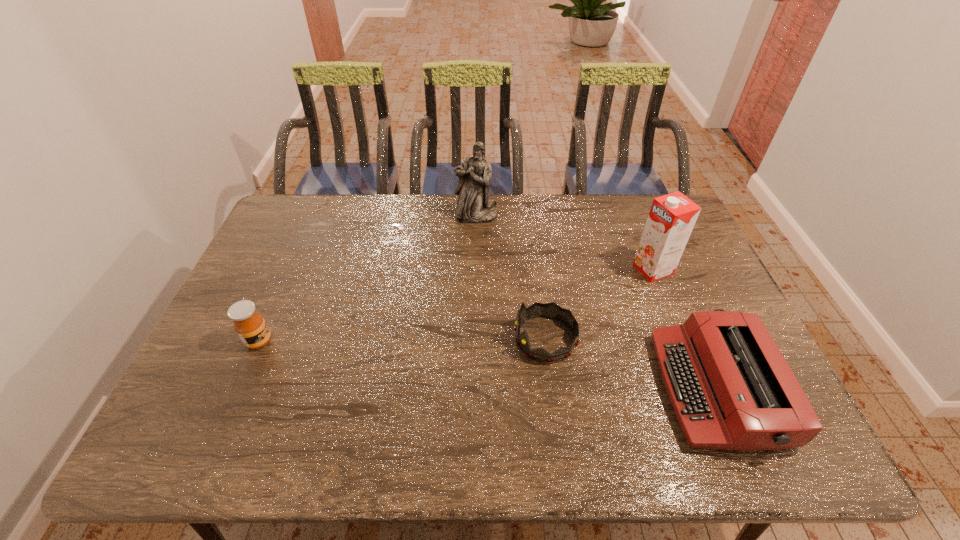
This screenshot has width=960, height=540. Identify the location of vacant space that is in between the typewriter and the figurine. (596, 302).

Identify the location of unoccupied area between the honey and the figurine. The image size is (960, 540). (368, 279).

At what (x,y) coordinates should I click in order to perform the action: click on free space that is in between the fourth object from right to left and the fourth nearest object. Please return your answer as a coordinate pair (x, y). This screenshot has height=540, width=960. Looking at the image, I should click on (564, 242).

I want to click on vacant area that lies between the third object from left to right and the figurine, so (x=511, y=278).

The image size is (960, 540). I want to click on object that is the closest to the figurine, so click(x=550, y=310).

This screenshot has width=960, height=540. I want to click on the closest object to the second object from left to right, so click(x=550, y=310).

Where is `free space that satisfies the following two spatial constraints: 1. on the front-facing side of the second object from left to right; 2. on the front-facing side of the leftmost object`? The height and width of the screenshot is (540, 960). free space that satisfies the following two spatial constraints: 1. on the front-facing side of the second object from left to right; 2. on the front-facing side of the leftmost object is located at coordinates (475, 341).

The image size is (960, 540). I want to click on vacant area that satisfies the following two spatial constraints: 1. on the front-facing side of the second object from left to right; 2. on the right side of the second farthest object, so click(476, 269).

I want to click on vacant region that satisfies the following two spatial constraints: 1. on the front-facing side of the second object from left to right; 2. on the front-facing side of the leftmost object, so click(x=475, y=341).